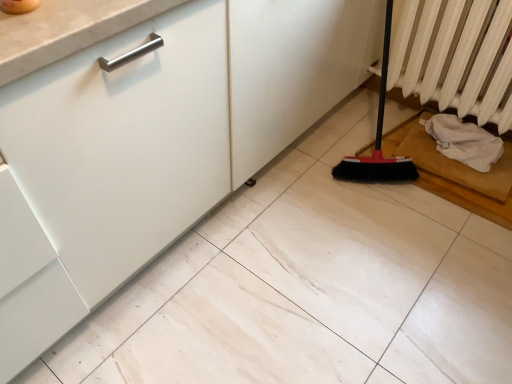
Question: Is white textured radiator at right wider than white fabric at lower right?

Choices:
 (A) no
 (B) yes

Answer: (A)

Question: Considering the relative sizes of white textured radiator at right and white fabric at lower right in the image provided, is white textured radiator at right taller than white fabric at lower right?

Choices:
 (A) yes
 (B) no

Answer: (A)

Question: Considering the relative sizes of white textured radiator at right and white fabric at lower right in the image provided, is white textured radiator at right smaller than white fabric at lower right?

Choices:
 (A) yes
 (B) no

Answer: (B)

Question: Does white textured radiator at right lie behind white fabric at lower right?

Choices:
 (A) no
 (B) yes

Answer: (A)

Question: Would you say white textured radiator at right is outside white fabric at lower right?

Choices:
 (A) no
 (B) yes

Answer: (B)

Question: Would you consider white textured radiator at right to be distant from white fabric at lower right?

Choices:
 (A) yes
 (B) no

Answer: (B)

Question: Is white textured radiator at right surrounded by white fabric at lower right?

Choices:
 (A) no
 (B) yes

Answer: (A)

Question: Does white fabric at lower right have a lesser width compared to white textured radiator at right?

Choices:
 (A) yes
 (B) no

Answer: (B)

Question: From a real-world perspective, does white fabric at lower right sit lower than white textured radiator at right?

Choices:
 (A) no
 (B) yes

Answer: (B)

Question: Does white fabric at lower right have a smaller size compared to white textured radiator at right?

Choices:
 (A) yes
 (B) no

Answer: (A)

Question: Can you see white fabric at lower right touching white textured radiator at right?

Choices:
 (A) no
 (B) yes

Answer: (A)

Question: Considering the relative positions of white fabric at lower right and white textured radiator at right in the image provided, is white fabric at lower right in front of white textured radiator at right?

Choices:
 (A) yes
 (B) no

Answer: (B)

Question: Is point (456, 99) closer or farther from the camera than point (452, 114)?

Choices:
 (A) closer
 (B) farther

Answer: (B)